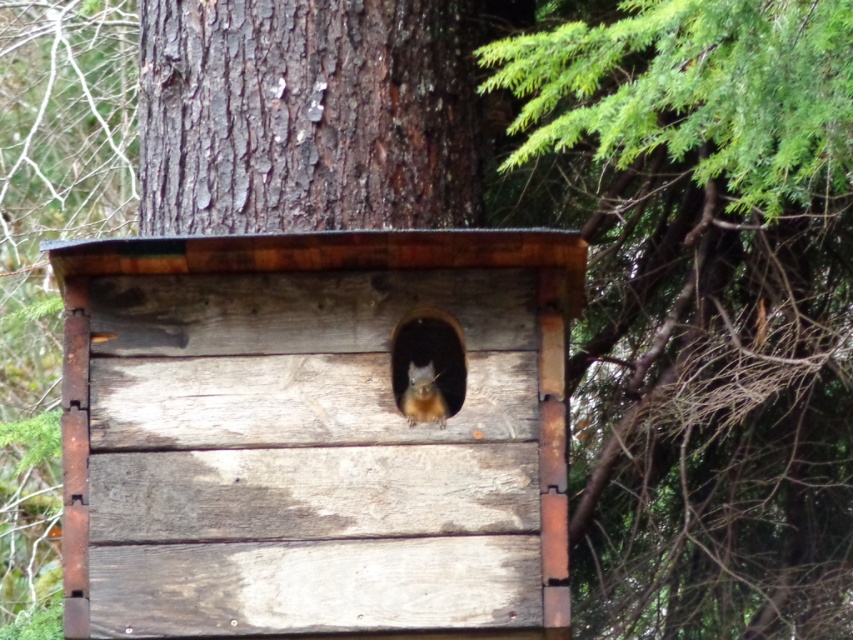
This screenshot has height=640, width=853. Find the location of `weathered wood at center`. weathered wood at center is located at coordinates [x=311, y=435].

Does weathered wood at center have a greater width compared to green leafy tree at upper right?

Correct, the width of weathered wood at center exceeds that of green leafy tree at upper right.

Is point (412, 570) positioned before point (640, 173)?

Yes, it is in front of point (640, 173).

Locate an element on the screen. The width and height of the screenshot is (853, 640). weathered wood at center is located at coordinates (311, 435).

Can you confirm if smooth wood hole at center is positioned above orange fur squirrel at center?

Correct, smooth wood hole at center is located above orange fur squirrel at center.

Does smooth wood hole at center have a larger size compared to orange fur squirrel at center?

Indeed, smooth wood hole at center has a larger size compared to orange fur squirrel at center.

Is point (422, 397) more distant than point (418, 376)?

That is False.

Find the location of a particular element. This screenshot has width=853, height=640. smooth wood hole at center is located at coordinates (428, 365).

Does green leafy tree at upper right appear under smooth wood hole at center?

No, green leafy tree at upper right is not below smooth wood hole at center.

Does green leafy tree at upper right appear over smooth wood hole at center?

Indeed, green leafy tree at upper right is positioned over smooth wood hole at center.

Where is `green leafy tree at upper right`? green leafy tree at upper right is located at coordinates (699, 304).